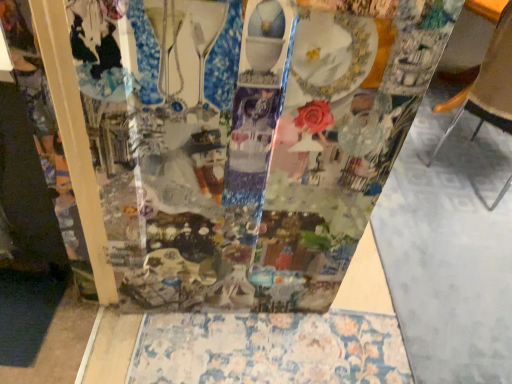
Question: Is brown leather chair at right situated inside transparent plastic collage at center or outside?

Choices:
 (A) outside
 (B) inside

Answer: (A)

Question: Does point (474, 89) appear closer or farther from the camera than point (102, 127)?

Choices:
 (A) closer
 (B) farther

Answer: (B)

Question: Which object is positioned farthest from the floral-patterned fabric at lower center?

Choices:
 (A) transparent plastic collage at center
 (B) brown leather chair at right

Answer: (B)

Question: Which of these objects is positioned closest to the transparent plastic collage at center?

Choices:
 (A) floral-patterned fabric at lower center
 (B) brown leather chair at right

Answer: (A)